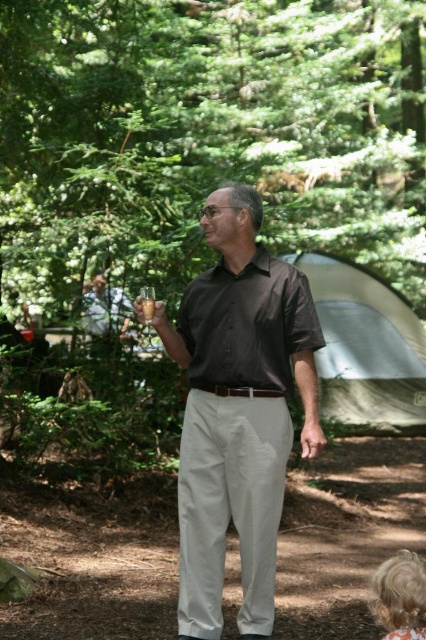
Does brown smooth shirt at center have a lesser width compared to matte black shirt at center?

No.

Who is more distant from viewer, [219,230] or [293,344]?

The point [219,230] is more distant.

Does point (192, 284) come farther from viewer compared to point (207, 323)?

That is True.

Locate an element on the screen. This screenshot has height=640, width=426. brown smooth shirt at center is located at coordinates (238, 412).

Can you confirm if green leafy tree at upper center is positioned to the left of matte black shirt at center?

No, green leafy tree at upper center is not to the left of matte black shirt at center.

Who is positioned more to the left, green leafy tree at upper center or matte black shirt at center?

Positioned to the left is matte black shirt at center.

You are a GUI agent. You are given a task and a screenshot of the screen. Output one action in this format:
    pyautogui.click(x=<x>, y=<y>)
    Task: Click on the green leafy tree at upper center
    
    Given the screenshot: What is the action you would take?
    pyautogui.click(x=201, y=131)

Which is above, green leafy tree at upper center or gray fabric tent at center?

green leafy tree at upper center is above.

Which is more to the left, green leafy tree at upper center or gray fabric tent at center?

green leafy tree at upper center is more to the left.

Identify the location of green leafy tree at upper center. The width and height of the screenshot is (426, 640). (201, 131).

The height and width of the screenshot is (640, 426). Identify the location of green leafy tree at upper center. (201, 131).